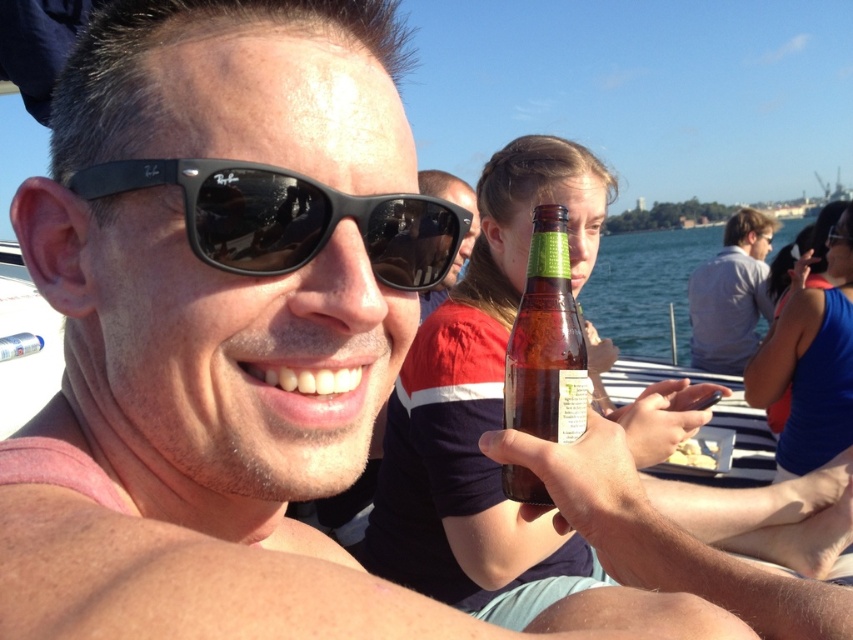
Who is positioned more to the right, clear blue water at center or gray cotton shirt at upper right?

Positioned to the right is clear blue water at center.

Is clear blue water at center below gray cotton shirt at upper right?

Incorrect, clear blue water at center is not positioned below gray cotton shirt at upper right.

Who is more forward, (601, 324) or (757, 266)?

Point (757, 266) is in front.

You are a GUI agent. You are given a task and a screenshot of the screen. Output one action in this format:
    pyautogui.click(x=<x>, y=<y>)
    Task: Click on the clear blue water at center
    
    Given the screenshot: What is the action you would take?
    pyautogui.click(x=653, y=288)

Is point (641, 333) farther from camera compared to point (544, 276)?

Yes, it is behind point (544, 276).

Is clear blue water at center in front of brown glass bottle at center?

No, clear blue water at center is behind brown glass bottle at center.

Between point (619, 291) and point (532, 296), which one is positioned in front?

Positioned in front is point (532, 296).

Where is `clear blue water at center`? The height and width of the screenshot is (640, 853). clear blue water at center is located at coordinates (653, 288).

Is point (216, 172) less distant than point (13, 356)?

Yes, point (216, 172) is closer to viewer.

Who is more distant from viewer, (252, 186) or (15, 346)?

Point (15, 346)

Between point (367, 212) and point (24, 355), which one is positioned behind?

The point (24, 355) is more distant.

In order to click on black matte sunglasses at center in this screenshot , I will do `click(289, 218)`.